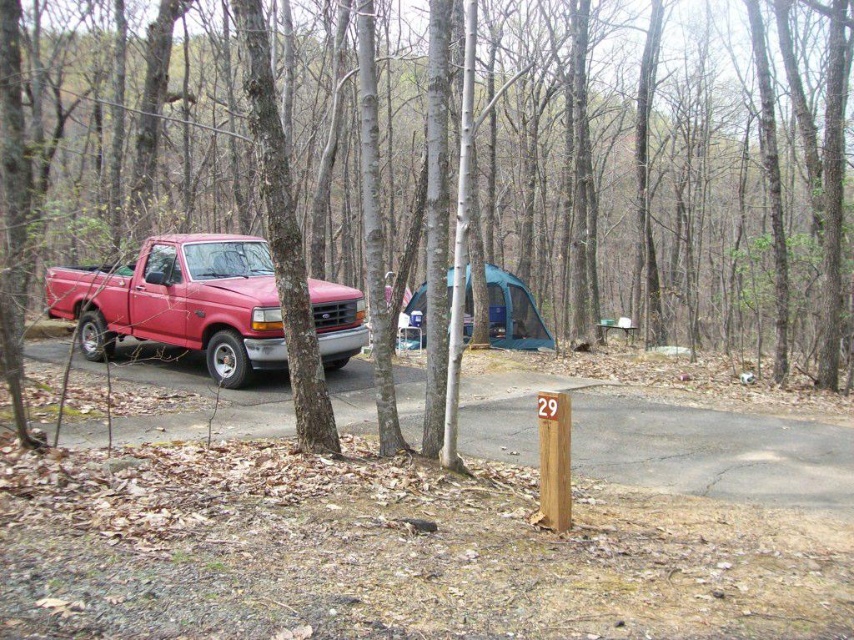
You are a hiker who needs to set up a tent exactly 30 feet away from the smooth bark tree at center. Can you place the teal fabric tent at center in the correct position?

The smooth bark tree at center and teal fabric tent at center are 31.46 feet apart from each other. Since 31.46 feet is more than 30 feet, placing the teal fabric tent at center would be slightly too far from the tree.

You are planning to park another vehicle that is 2 meters wide in the camping area. The space between the matte red truck at left and the teal fabric tent at center is available. Can you fit your vehicle there?

The space between the matte red truck at left and the teal fabric tent at center might be wider than 2 meters since the truck might be wider than the tent. However, without exact measurements, it is uncertain if the available space is sufficient for the 2 meter wide vehicle.